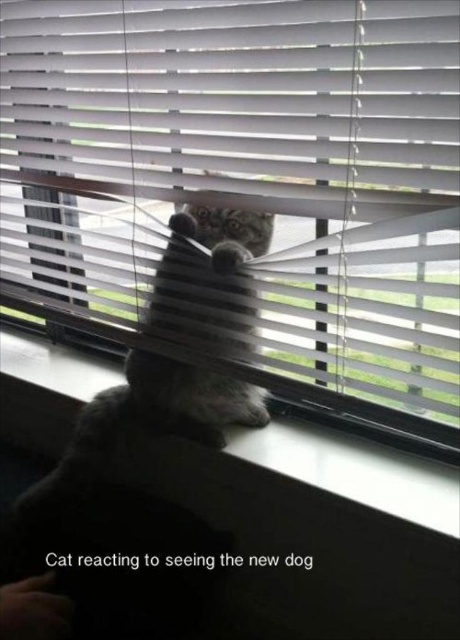
You are a small toy mouse that is 3 inches long. You want to hide between the white plastic blinds at center and the white plastic window sill at center. Is there enough space for you to hide there?

The distance between the white plastic blinds at center and the white plastic window sill at center is 18.38 inches, which is more than enough space for the 3 inch long toy mouse to hide comfortably.

Based on the photo, you are a cat owner who wants to ensure your gray fluffy cat at center has enough space to move comfortably on the white plastic window sill at center. Based on the scene, can you confirm if the window sill is large enough for the cat?

The gray fluffy cat at center is positioned over white plastic window sill at center, which means the window sill is large enough to support the cat comfortably.

You are a cat sitting on the white plastic window sill at center and want to look outside. Which direction should you move to see through the white plastic blinds at center?

The white plastic blinds at center are to the left of the white plastic window sill at center. So, to see through the white plastic blinds at center, the cat should move to the left side of the white plastic window sill at center.